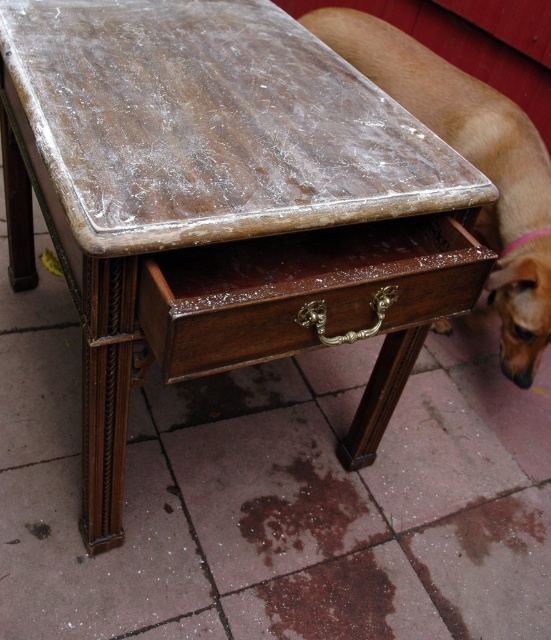
Does shiny brown wood drawer at center come behind brown fur dog at lower right?

No, it is in front of brown fur dog at lower right.

Is point (197, 323) closer to camera compared to point (493, 116)?

Yes, point (197, 323) is in front of point (493, 116).

This screenshot has height=640, width=551. In order to click on shiny brown wood drawer at center in this screenshot , I will do `click(304, 291)`.